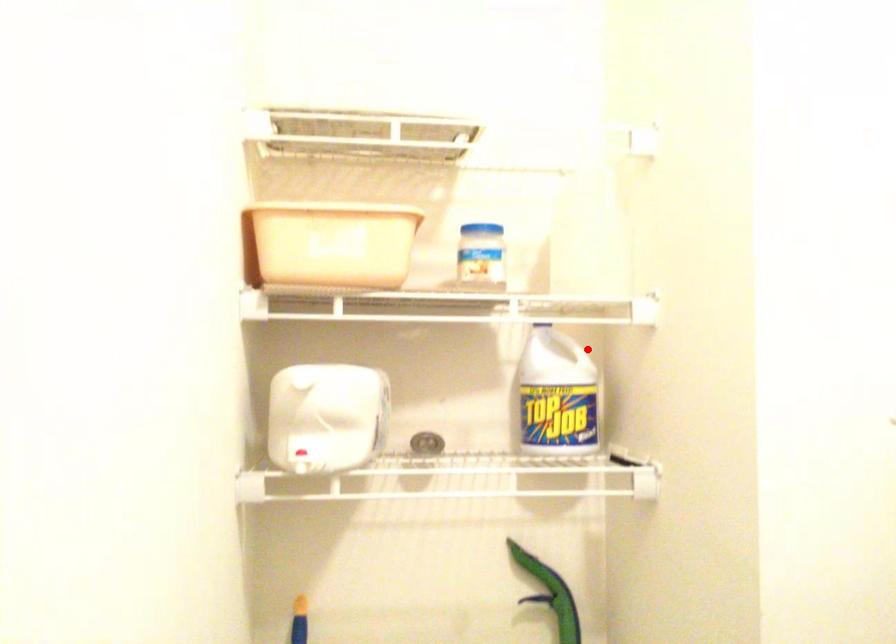
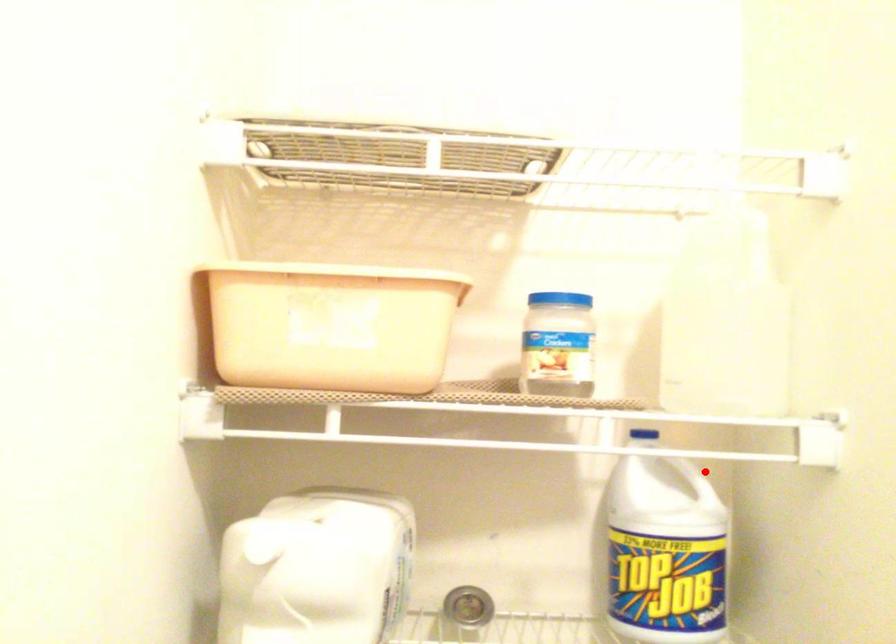
I am providing you with two images of the same scene from different viewpoints. A red point is marked on the first image and another point is marked on the second image. Is the red point in image1 aligned with the point shown in image2?

Yes